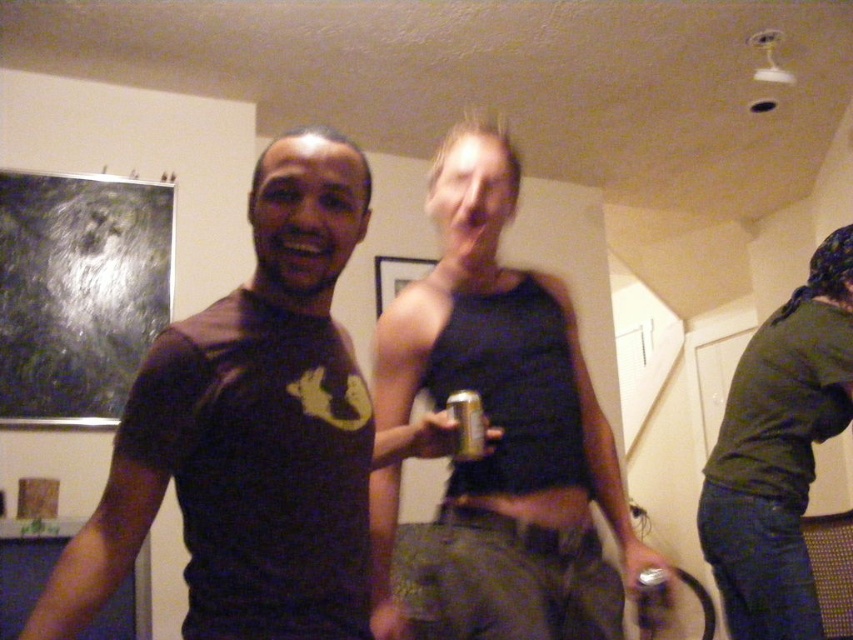
Does metallic can at center have a smaller size compared to green matte shirt at right?

A: Indeed, metallic can at center has a smaller size compared to green matte shirt at right.

Is metallic can at center closer to camera compared to green matte shirt at right?

Yes, it is in front of green matte shirt at right.

Between point (566, 572) and point (779, 579), which one is positioned behind?

Point (779, 579)

Find the location of `metallic can at center`. metallic can at center is located at coordinates (508, 419).

Does metallic can at center appear over metallic silver can at center?

Indeed, metallic can at center is positioned over metallic silver can at center.

Does point (465, 243) come farther from viewer compared to point (463, 458)?

Yes.

The height and width of the screenshot is (640, 853). In order to click on metallic can at center in this screenshot , I will do `click(508, 419)`.

Is matte black t-shirt at center shorter than green matte shirt at right?

Yes, matte black t-shirt at center is shorter than green matte shirt at right.

Is matte black t-shirt at center taller than green matte shirt at right?

No, matte black t-shirt at center is not taller than green matte shirt at right.

The image size is (853, 640). Find the location of `matte black t-shirt at center`. matte black t-shirt at center is located at coordinates (250, 433).